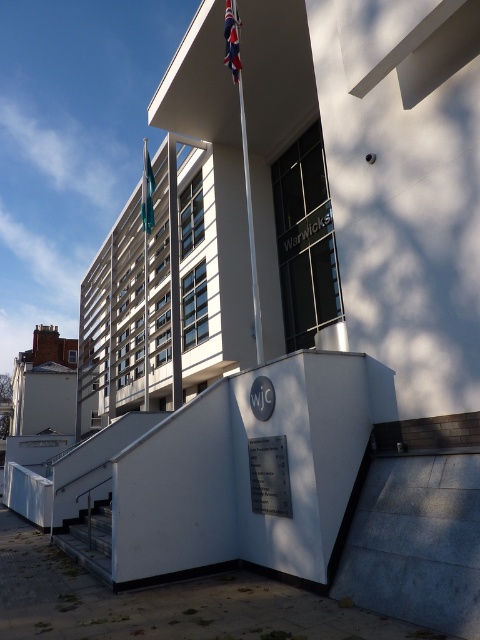
You are a visitor approaching the building and want to reach the entrance. You notice the polished metal flag pole at center and the metallic gray staircase at lower left. Which object is taller and would cast a longer shadow at noon?

The polished metal flag pole at center is much taller than the metallic gray staircase at lower left, so it would cast a longer shadow at noon.